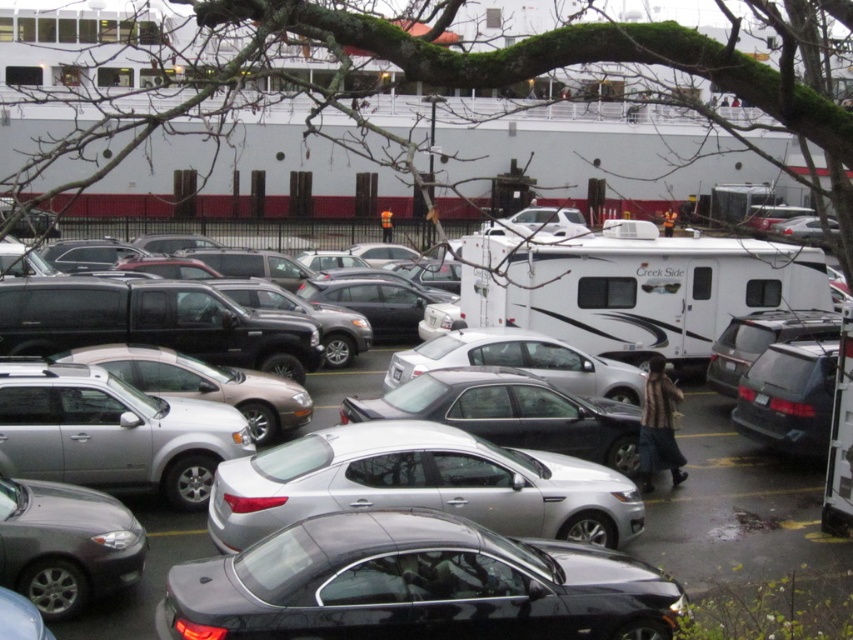
Who is positioned more to the right, glossy black sedan at center or satin black suv at right?

Positioned to the right is satin black suv at right.

Is glossy black sedan at center to the left of satin black suv at right from the viewer's perspective?

Yes, glossy black sedan at center is to the left of satin black suv at right.

The height and width of the screenshot is (640, 853). What do you see at coordinates (416, 586) in the screenshot? I see `glossy black sedan at center` at bounding box center [416, 586].

Find the location of a particular element. Image resolution: width=853 pixels, height=640 pixels. glossy black sedan at center is located at coordinates (416, 586).

Does point (57, 561) come farther from viewer compared to point (833, 349)?

That is False.

Between satin silver sedan at lower left and satin black suv at right, which one appears on the right side from the viewer's perspective?

satin black suv at right

Measure the distance between point (111, 554) and camera.

The distance of point (111, 554) from camera is 29.11 feet.

In order to click on satin silver sedan at lower left in this screenshot , I will do `click(64, 544)`.

Between satin silver sedan at center and silver metallic car at center, which one has more height?

With more height is silver metallic car at center.

What are the coordinates of `satin silver sedan at center` in the screenshot? It's located at (421, 484).